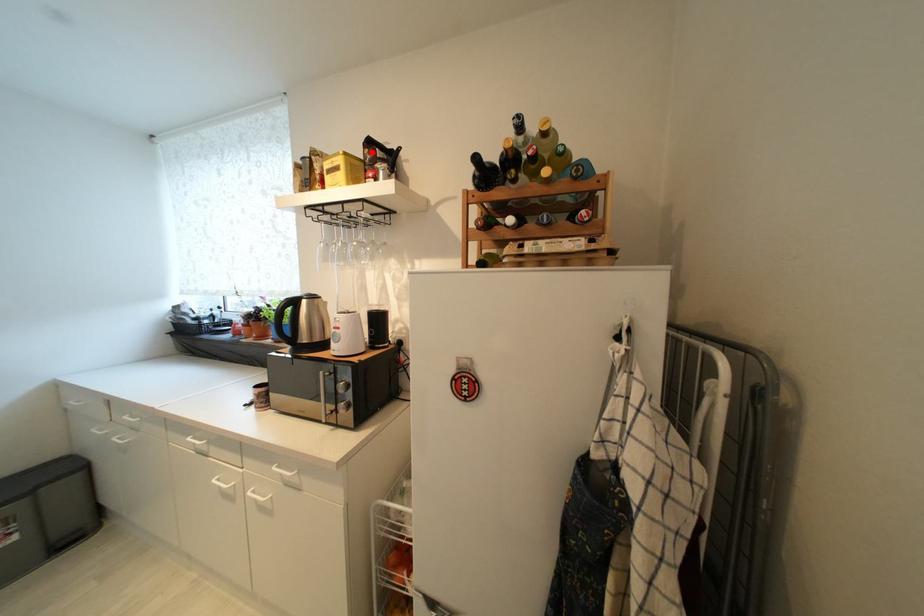
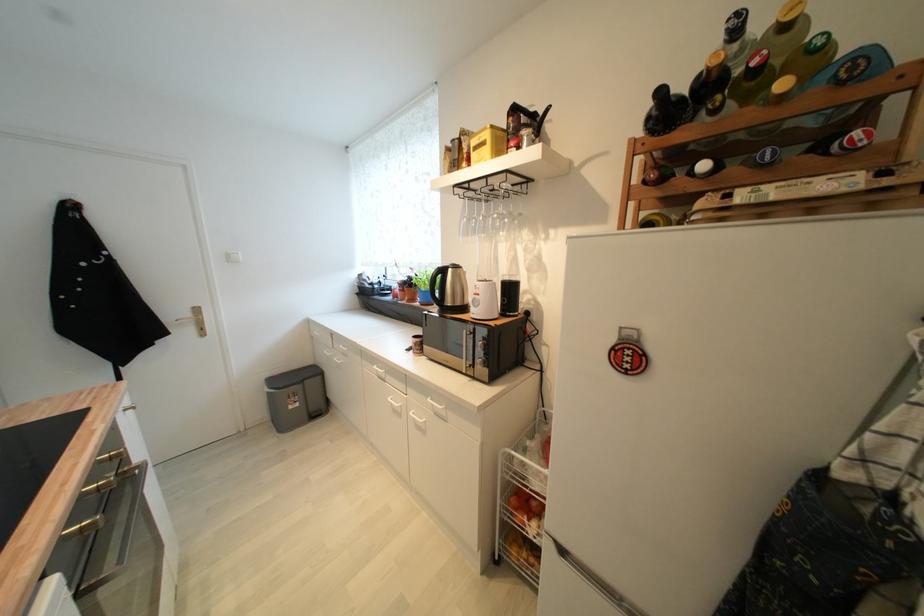
Find the pixel in the second image that matches the highlighted location in the first image.

(516, 121)